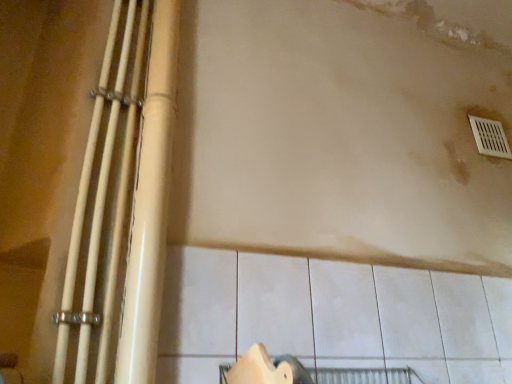
Question: In the image, is white glossy pipes at left, positioned as the first beam in left-to-right order, positioned in front of or behind matte beige pipes at left, the first beam positioned from the right?

Choices:
 (A) front
 (B) behind

Answer: (A)

Question: Based on their sizes in the image, would you say white glossy pipes at left, positioned as the first beam in left-to-right order, is bigger or smaller than matte beige pipes at left, the first beam positioned from the right?

Choices:
 (A) small
 (B) big

Answer: (A)

Question: Estimate the real-world distances between objects in this image. Which object is farther from the matte beige pipes at left, which is counted as the second beam, starting from the left?

Choices:
 (A) white glossy pipes at left, positioned as the first beam in left-to-right order
 (B) white plastic vent at upper right

Answer: (B)

Question: Which object is positioned closest to the matte beige pipes at left, which is counted as the second beam, starting from the left?

Choices:
 (A) white glossy pipes at left, the 2th beam viewed from the right
 (B) white plastic vent at upper right

Answer: (A)